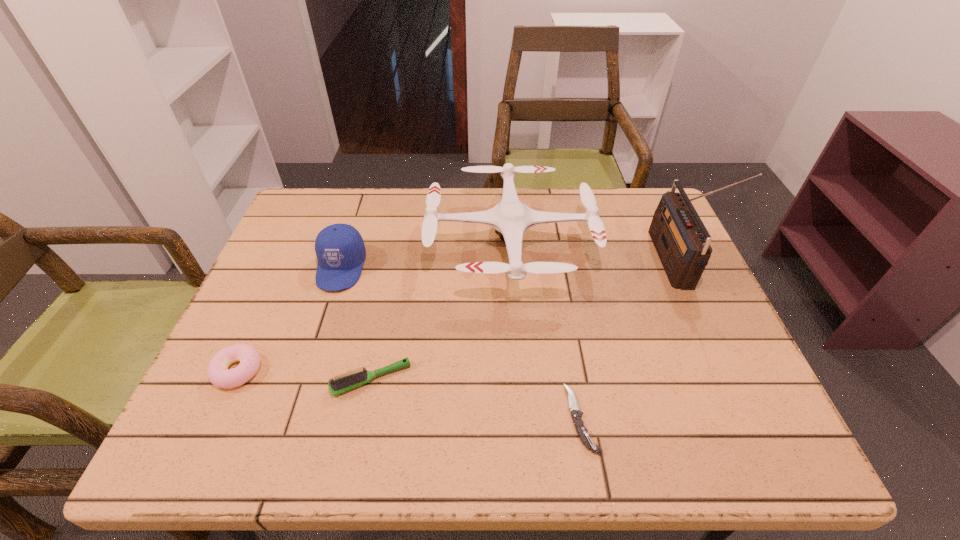
Where is `empty location between the third tallest object and the hairbrush`? empty location between the third tallest object and the hairbrush is located at coordinates (356, 323).

The height and width of the screenshot is (540, 960). What are the coordinates of `vacant space that's between the hairbrush and the shortest object` in the screenshot? It's located at (476, 399).

In order to click on free point between the drone and the tallest object in this screenshot , I will do 590,252.

You are a GUI agent. You are given a task and a screenshot of the screen. Output one action in this format:
    pyautogui.click(x=<x>, y=<y>)
    Task: Click on the free space between the cap and the hairbrush
    
    Given the screenshot: What is the action you would take?
    pyautogui.click(x=356, y=323)

At what (x,y) coordinates should I click in order to perform the action: click on free space between the hairbrush and the drone. Please return your answer as a coordinate pair (x, y). This screenshot has width=960, height=540. Looking at the image, I should click on (441, 311).

Find the location of a particular element. empty location between the fourth shortest object and the hairbrush is located at coordinates (356, 323).

In order to click on free point between the drone and the fourth shortest object in this screenshot , I will do `click(425, 255)`.

Image resolution: width=960 pixels, height=540 pixels. I want to click on vacant space in between the pocketknife and the cap, so click(x=461, y=343).

Locate an element on the screen. This screenshot has width=960, height=540. vacant area between the radio receiver and the doughnut is located at coordinates (454, 315).

Find the location of `free space between the hairbrush and the leftmost object`. free space between the hairbrush and the leftmost object is located at coordinates (304, 374).